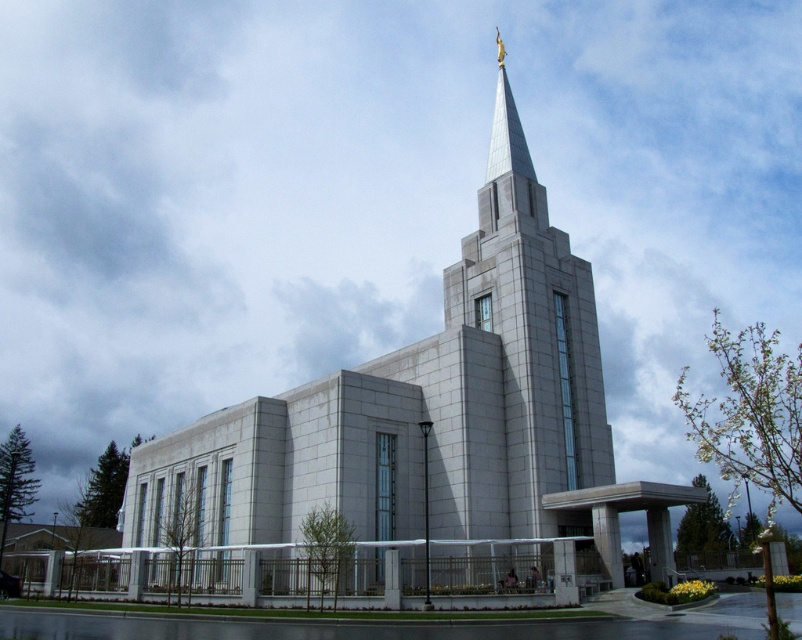
You are an architect designing a new plaza adjacent to the white stone church at center and the white stone spire at center. Your design requires knowing which structure is wider. Which one is wider?

The white stone church at center is wider than the white stone spire at center.

You are a visitor standing in front of the white stone church at center and the white stone spire at center. Which structure do you see rising higher into the sky?

The white stone church at center is much taller than the white stone spire at center, so you see the white stone church at center rising higher into the sky.

You are standing in front of the temple and want to take a photo that includes both the golden statue at the tip of the spire and another architectural feature. The golden statue is located at point (x=326, y=486), and the other feature is at point (x=562, y=332). Which of these points is closer to your camera when you take the photo?

Point (x=326, y=486) is closer to the camera than point (x=562, y=332), so the golden statue at point (x=326, y=486) will appear larger in the photo compared to the other feature at point (x=562, y=332).